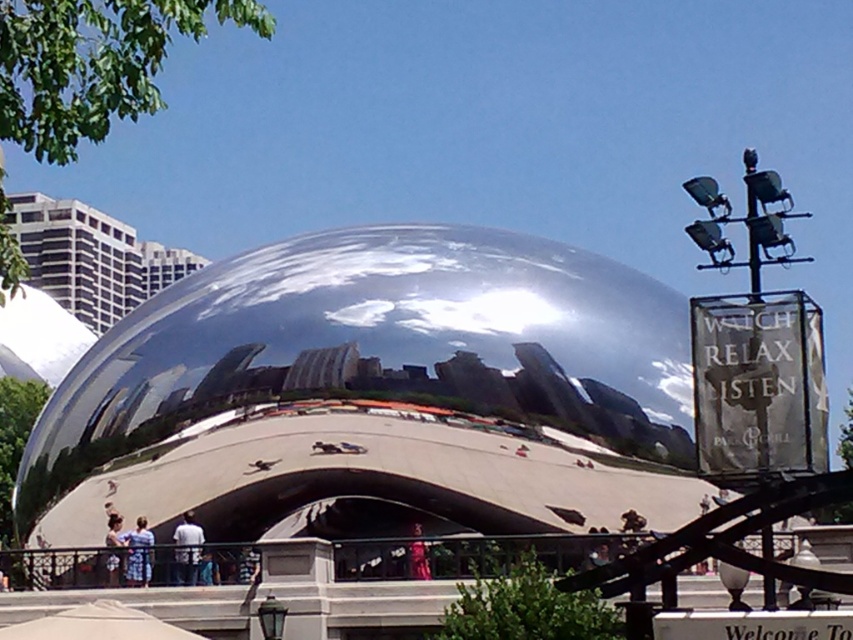
You are standing at the center of the paved area in front of Cloud Gate sculpture. You notice a pair of blue denim jeans at lower left. Where exactly is the blue denim jeans located in relation to your current position?

The blue denim jeans at lower left is located at point [113,548] relative to your current position at the center of the paved area.

You are a photographer standing at the base of Cloud Gate sculpture. You see a person wearing blue denim jeans at lower left and another wearing a matte pink dress at center. If you want to capture both subjects in a single frame without moving your camera, which subject should be closer to the camera?

The blue denim jeans at lower left is positioned on the left side of matte pink dress at center, so the blue denim jeans at lower left is closer to the camera.

You are standing at the base of the Cloud Gate sculpture and notice two people in the foreground. One is wearing light blue jeans at lower center and the other is wearing a matte pink dress at center. From your perspective, which person is standing closer to the sculpture?

The light blue jeans at lower center is located above the matte pink dress at center, so the person wearing light blue jeans at lower center is standing closer to the sculpture.